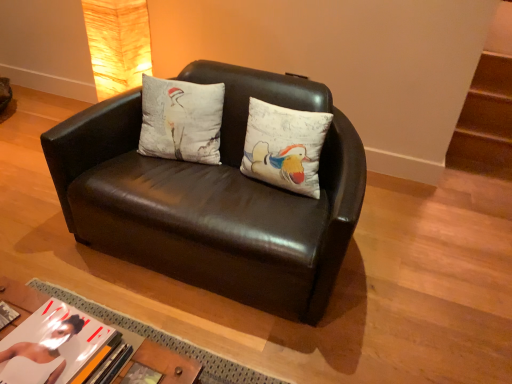
The height and width of the screenshot is (384, 512). Identify the location of spots to the right of matte black couch at center. (419, 266).